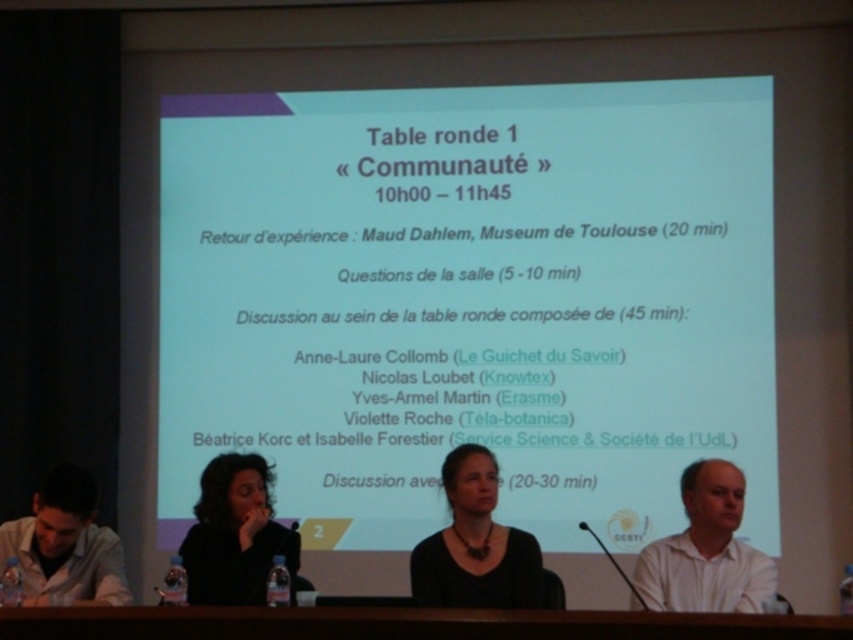
Does white matte shirt at lower right have a lesser width compared to matte black hair at lower left?

No.

You are a GUI agent. You are given a task and a screenshot of the screen. Output one action in this format:
    pyautogui.click(x=<x>, y=<y>)
    Task: Click on the white matte shirt at lower right
    The height and width of the screenshot is (640, 853).
    Given the screenshot: What is the action you would take?
    pyautogui.click(x=706, y=550)

The image size is (853, 640). Find the location of `white matte shirt at lower right`. white matte shirt at lower right is located at coordinates (706, 550).

Looking at this image, is white matte shirt at lower right above matte white shirt at lower left?

No, white matte shirt at lower right is not above matte white shirt at lower left.

Is point (697, 561) positioned after point (112, 593)?

No, (697, 561) is in front of (112, 593).

Where is `white matte shirt at lower right`? The width and height of the screenshot is (853, 640). white matte shirt at lower right is located at coordinates (x=706, y=550).

Where is `white matte projector screen at upper center`? The height and width of the screenshot is (640, 853). white matte projector screen at upper center is located at coordinates (469, 301).

Does point (552, 93) come closer to viewer compared to point (437, 604)?

No, it is behind (437, 604).

At what (x,y) coordinates should I click in order to perform the action: click on white matte projector screen at upper center. Please return your answer as a coordinate pair (x, y). The height and width of the screenshot is (640, 853). Looking at the image, I should click on (469, 301).

Locate an element on the screen. white matte projector screen at upper center is located at coordinates (469, 301).